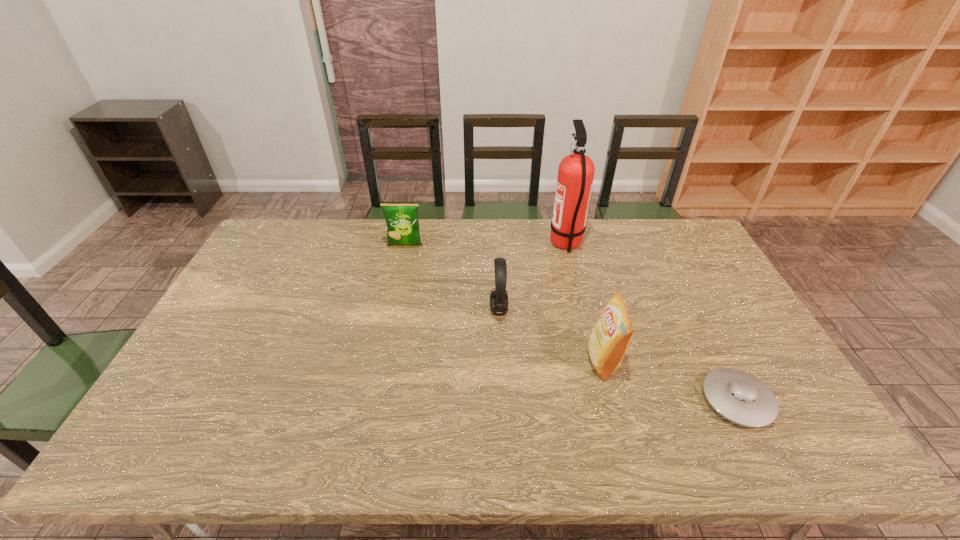
This screenshot has width=960, height=540. I want to click on blank area in the image that satisfies the following two spatial constraints: 1. on the handle side of the rightmost object; 2. on the right side of the fire extinguisher, so click(605, 401).

Locate an element on the screen. Image resolution: width=960 pixels, height=540 pixels. vacant point that satisfies the following two spatial constraints: 1. on the front-facing side of the saucer; 2. on the right side of the third nearest object is located at coordinates (503, 401).

The width and height of the screenshot is (960, 540). What are the coordinates of `free spot that satisfies the following two spatial constraints: 1. on the handle side of the saucer; 2. on the left side of the fire extinguisher` in the screenshot? It's located at (605, 401).

At what (x,y) coordinates should I click in order to perform the action: click on vacant space that satisfies the following two spatial constraints: 1. on the front-facing side of the third farthest object; 2. on the left side of the rightmost object. Please return your answer as a coordinate pair (x, y). This screenshot has width=960, height=540. Looking at the image, I should click on (503, 401).

The width and height of the screenshot is (960, 540). Identify the location of vacant region that satisfies the following two spatial constraints: 1. on the front-facing side of the second object from left to right; 2. on the back side of the shortest object. (503, 401).

Identify the location of vacant area that satisfies the following two spatial constraints: 1. on the handle side of the fire extinguisher; 2. on the left side of the rightmost object. (605, 401).

Find the location of a particular element. Image resolution: width=960 pixels, height=540 pixels. free space that satisfies the following two spatial constraints: 1. on the front-facing side of the fourth object from right to left; 2. on the back side of the saucer is located at coordinates (503, 401).

Locate an element on the screen. free space that satisfies the following two spatial constraints: 1. on the front-facing side of the left crisp (potato chip); 2. on the left side of the saucer is located at coordinates (372, 401).

At what (x,y) coordinates should I click in order to perform the action: click on vacant space that satisfies the following two spatial constraints: 1. on the back side of the saucer; 2. on the handle side of the tallest object. Please return your answer as a coordinate pair (x, y). The height and width of the screenshot is (540, 960). Looking at the image, I should click on (658, 244).

Locate an element on the screen. This screenshot has width=960, height=540. free spot that satisfies the following two spatial constraints: 1. on the handle side of the saucer; 2. on the right side of the tallest object is located at coordinates (605, 401).